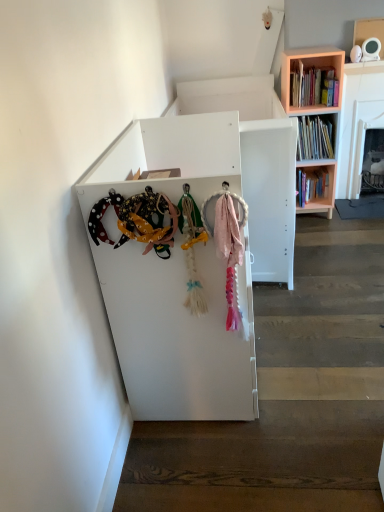
Question: Is pink fabric at lower right inside pink wooden bookcase at upper right?

Choices:
 (A) yes
 (B) no

Answer: (B)

Question: From a real-world perspective, is pink wooden bookcase at upper right under pink fabric at lower right?

Choices:
 (A) no
 (B) yes

Answer: (A)

Question: Is pink wooden bookcase at upper right wider than pink fabric at lower right?

Choices:
 (A) yes
 (B) no

Answer: (B)

Question: Considering the relative positions of pink wooden bookcase at upper right and pink fabric at lower right in the image provided, is pink wooden bookcase at upper right to the left of pink fabric at lower right from the viewer's perspective?

Choices:
 (A) yes
 (B) no

Answer: (A)

Question: Is pink wooden bookcase at upper right next to pink fabric at lower right and touching it?

Choices:
 (A) no
 (B) yes

Answer: (A)

Question: Does pink wooden bookcase at upper right turn towards pink fabric at lower right?

Choices:
 (A) yes
 (B) no

Answer: (A)

Question: Is hardcover books at upper right facing away from pink fabric at lower right?

Choices:
 (A) no
 (B) yes

Answer: (A)

Question: Would you say hardcover books at upper right is a long distance from pink fabric at lower right?

Choices:
 (A) yes
 (B) no

Answer: (A)

Question: Does hardcover books at upper right have a greater height compared to pink fabric at lower right?

Choices:
 (A) yes
 (B) no

Answer: (A)

Question: Is pink fabric at lower right surrounded by hardcover books at upper right?

Choices:
 (A) no
 (B) yes

Answer: (A)

Question: From the image's perspective, does hardcover books at upper right appear lower than pink fabric at lower right?

Choices:
 (A) yes
 (B) no

Answer: (B)

Question: Considering the relative sizes of hardcover books at upper right and pink fabric at lower right in the image provided, is hardcover books at upper right thinner than pink fabric at lower right?

Choices:
 (A) no
 (B) yes

Answer: (B)

Question: Can you confirm if hardcover books at upper right is smaller than pink wooden bookcase at upper right?

Choices:
 (A) yes
 (B) no

Answer: (A)